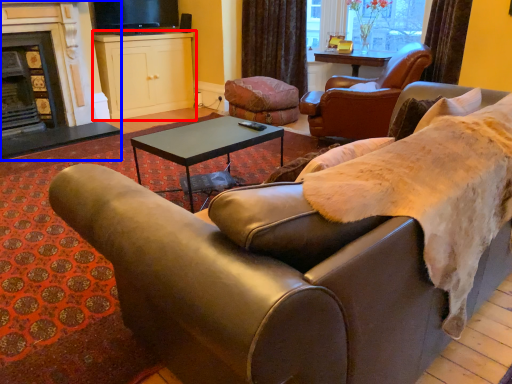
Question: Which object is closer to the camera taking this photo, cabinetry (highlighted by a red box) or fireplace (highlighted by a blue box)?

Choices:
 (A) cabinetry
 (B) fireplace

Answer: (B)